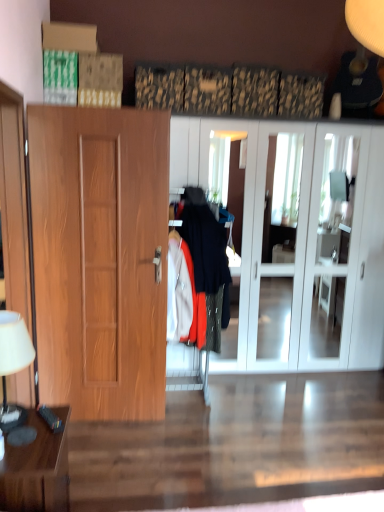
Question: Is brown wooden table at lower left turned away from black plastic remote control at lower left?

Choices:
 (A) yes
 (B) no

Answer: (B)

Question: Does brown wooden table at lower left appear on the left side of black plastic remote control at lower left?

Choices:
 (A) yes
 (B) no

Answer: (A)

Question: Is brown wooden table at lower left aimed at black plastic remote control at lower left?

Choices:
 (A) no
 (B) yes

Answer: (A)

Question: Is brown wooden table at lower left thinner than black plastic remote control at lower left?

Choices:
 (A) yes
 (B) no

Answer: (B)

Question: Can you confirm if brown wooden table at lower left is smaller than black plastic remote control at lower left?

Choices:
 (A) yes
 (B) no

Answer: (B)

Question: Considering the positions of white fabric lampshade at left and white glossy cabinet at center in the image, is white fabric lampshade at left taller or shorter than white glossy cabinet at center?

Choices:
 (A) tall
 (B) short

Answer: (B)

Question: From a real-world perspective, is white fabric lampshade at left physically located above or below white glossy cabinet at center?

Choices:
 (A) above
 (B) below

Answer: (B)

Question: From the image's perspective, is white fabric lampshade at left positioned above or below white glossy cabinet at center?

Choices:
 (A) above
 (B) below

Answer: (B)

Question: In the image, is white fabric lampshade at left positioned in front of or behind white glossy cabinet at center?

Choices:
 (A) behind
 (B) front

Answer: (B)

Question: From a real-world perspective, is black plastic remote control at lower left above or below white fabric lampshade at left?

Choices:
 (A) below
 (B) above

Answer: (A)

Question: Looking at their shapes, would you say black plastic remote control at lower left is wider or thinner than white fabric lampshade at left?

Choices:
 (A) wide
 (B) thin

Answer: (B)

Question: In the image, is black plastic remote control at lower left on the left side or the right side of white fabric lampshade at left?

Choices:
 (A) left
 (B) right

Answer: (B)

Question: From the image's perspective, relative to white fabric lampshade at left, is black plastic remote control at lower left above or below?

Choices:
 (A) below
 (B) above

Answer: (A)

Question: Based on their positions, is brown wooden table at lower left located to the left or right of black plastic remote control at lower left?

Choices:
 (A) right
 (B) left

Answer: (B)

Question: Is brown wooden table at lower left wider or thinner than black plastic remote control at lower left?

Choices:
 (A) wide
 (B) thin

Answer: (A)